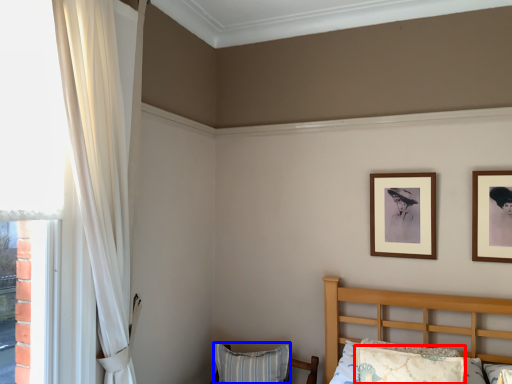
Question: Among these objects, which one is farthest to the camera, pillow (highlighted by a red box) or pillow (highlighted by a blue box)?

Choices:
 (A) pillow
 (B) pillow

Answer: (B)